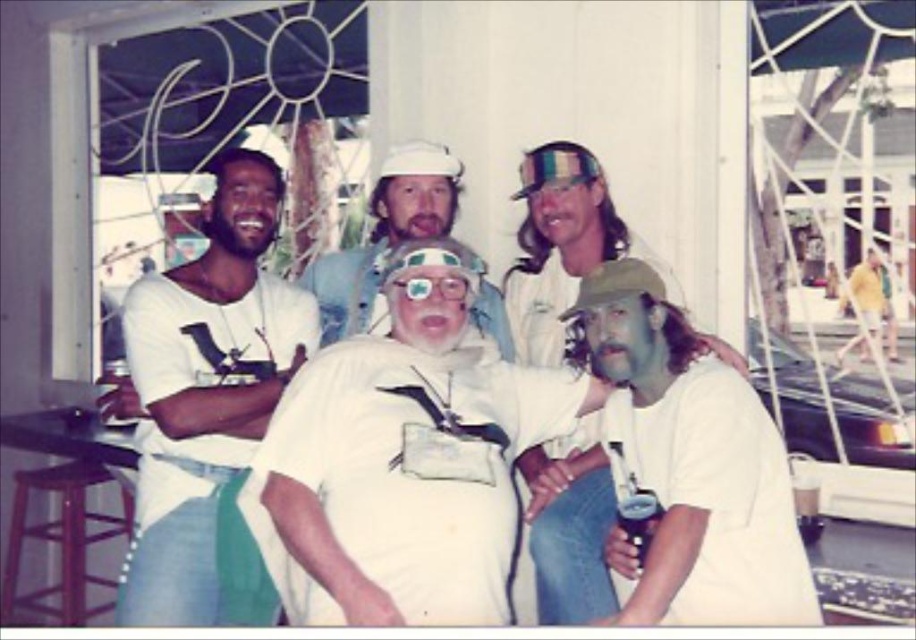
You are a photographer trying to capture a group photo. You notice the white cotton shirt at left and the wooden stool at lower left in the frame. Which object should you adjust to ensure both are equally visible in the photo?

Since the white cotton shirt at left is smaller in size compared to the wooden stool at lower left, you should move the white cotton shirt at left closer to the camera to make it appear larger in the frame, balancing its visibility with the wooden stool at lower left.

You are a photographer standing in front of the group. You want to take a photo of the white matte hat at center without including any of the other people in the image. Is the distance between you and the hat sufficient to allow you to zoom in closely on it while excluding the other people?

The distance between you and the white matte hat at center is 2.58 meters. Since the hat is at the center and the other people are standing behind it, zooming in at this distance should allow you to focus on the hat while excluding the others.

You are a photographer setting up for a group photo. You notice the white matte hat at center and the clear plastic goggles at center in the scene. Which object is positioned higher in the image?

The white matte hat at center is above the clear plastic goggles at center, so it is positioned higher.